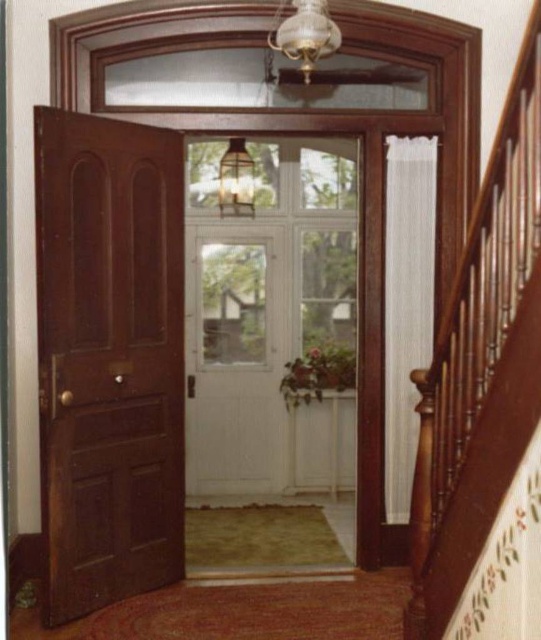
Question: Can you confirm if wooden stair rail at right is smaller than white wood door at center?

Choices:
 (A) yes
 (B) no

Answer: (B)

Question: Which object is the farthest from the white wood door at center?

Choices:
 (A) shiny dark wood door at left
 (B) wooden stair rail at right

Answer: (B)

Question: Which point is farther from the camera taking this photo?

Choices:
 (A) (289, 250)
 (B) (110, 332)
 (C) (531, 205)

Answer: (A)

Question: Among these objects, which one is nearest to the camera?

Choices:
 (A) wooden stair rail at right
 (B) white wood door at center
 (C) shiny dark wood door at left

Answer: (A)

Question: Can you confirm if shiny dark wood door at left is thinner than wooden stair rail at right?

Choices:
 (A) no
 (B) yes

Answer: (A)

Question: Does shiny dark wood door at left have a lesser width compared to white wood door at center?

Choices:
 (A) no
 (B) yes

Answer: (B)